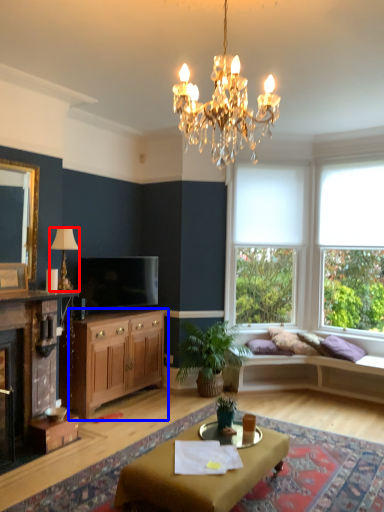
Question: Which object appears closest to the camera in this image, lamp (highlighted by a red box) or cabinetry (highlighted by a blue box)?

Choices:
 (A) lamp
 (B) cabinetry

Answer: (A)